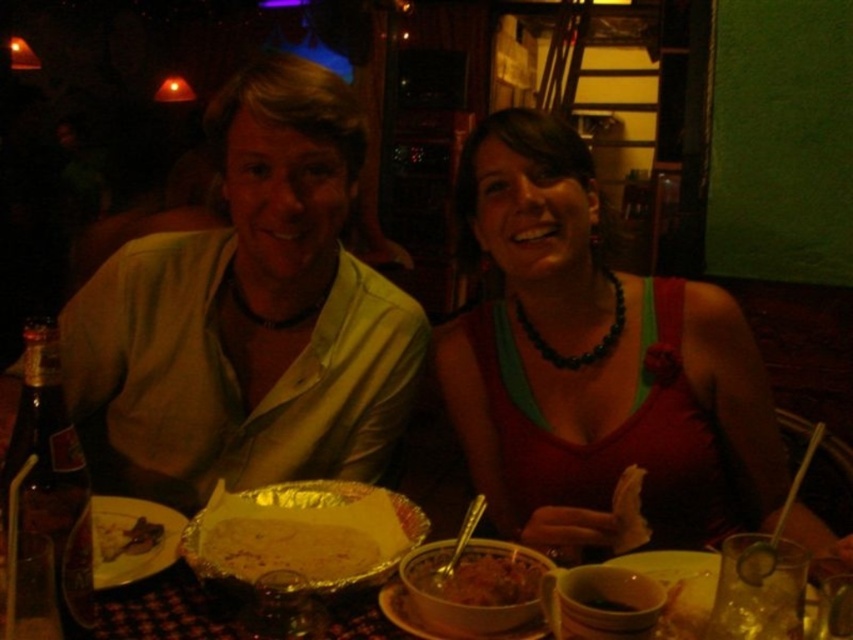
Can you confirm if matte red tank top at center is wider than shiny aluminum foil at center?

Yes, matte red tank top at center is wider than shiny aluminum foil at center.

Who is more distant from viewer, (x=596, y=188) or (x=218, y=548)?

The point (x=596, y=188) is more distant.

I want to click on matte red tank top at center, so click(x=595, y=364).

Identify the location of matte red tank top at center. This screenshot has width=853, height=640. (595, 364).

Does point (231, 124) lie behind point (132, 531)?

Yes.

Is matte green dress at center to the right of brown crispy meat at lower left from the viewer's perspective?

Indeed, matte green dress at center is positioned on the right side of brown crispy meat at lower left.

Identify the location of matte green dress at center. (248, 314).

Locate an element on the screen. matte green dress at center is located at coordinates (248, 314).

This screenshot has width=853, height=640. Describe the element at coordinates (248, 314) in the screenshot. I see `matte green dress at center` at that location.

Is matte green dress at center below shiny metallic bowl at center?

No.

In order to click on matte green dress at center in this screenshot , I will do `click(248, 314)`.

This screenshot has width=853, height=640. Find the location of `matte green dress at center`. matte green dress at center is located at coordinates (x=248, y=314).